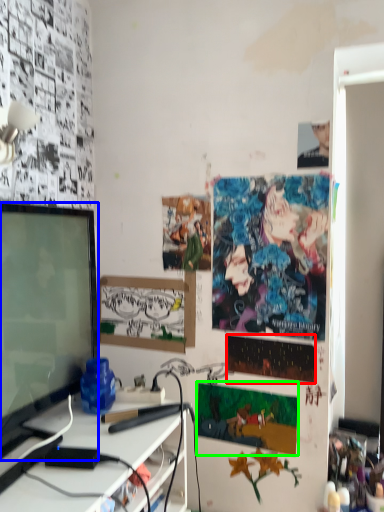
Question: Based on their relative distances, which object is nearer to poster page (highlighted by a red box)? Choose from television (highlighted by a blue box) and poster page (highlighted by a green box).

Choices:
 (A) television
 (B) poster page

Answer: (B)